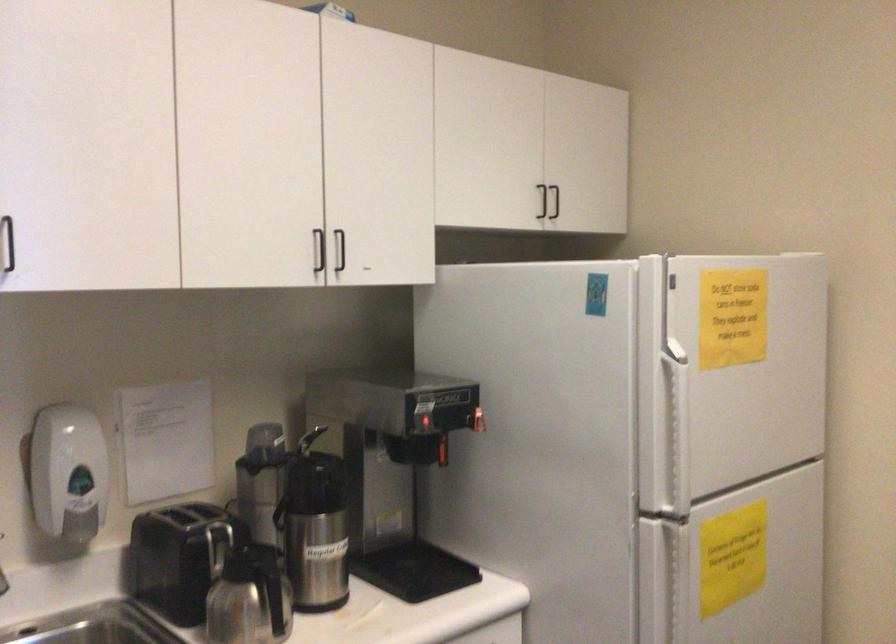
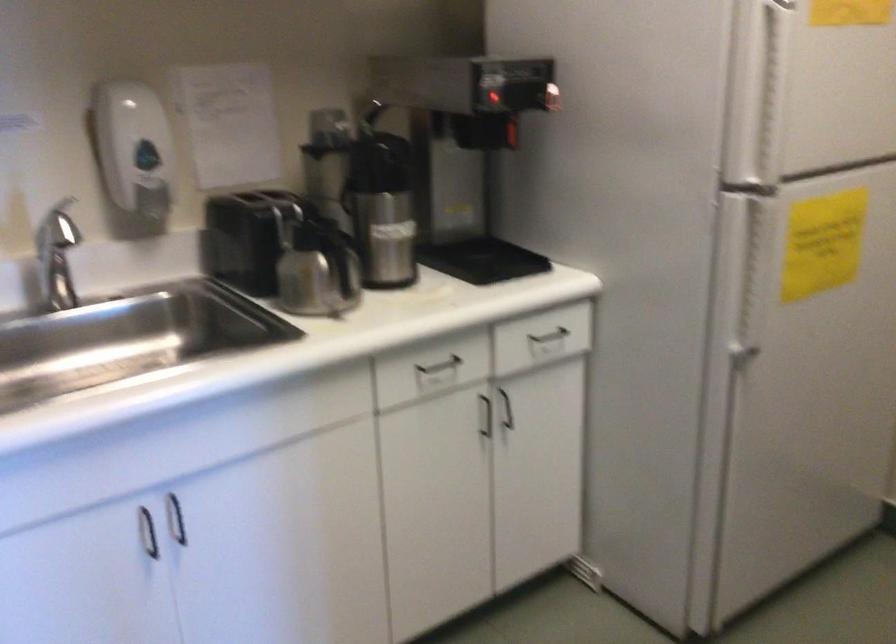
In a continuous first-person perspective shot, in which direction is the camera moving?

The cameraman walked toward right, forward.